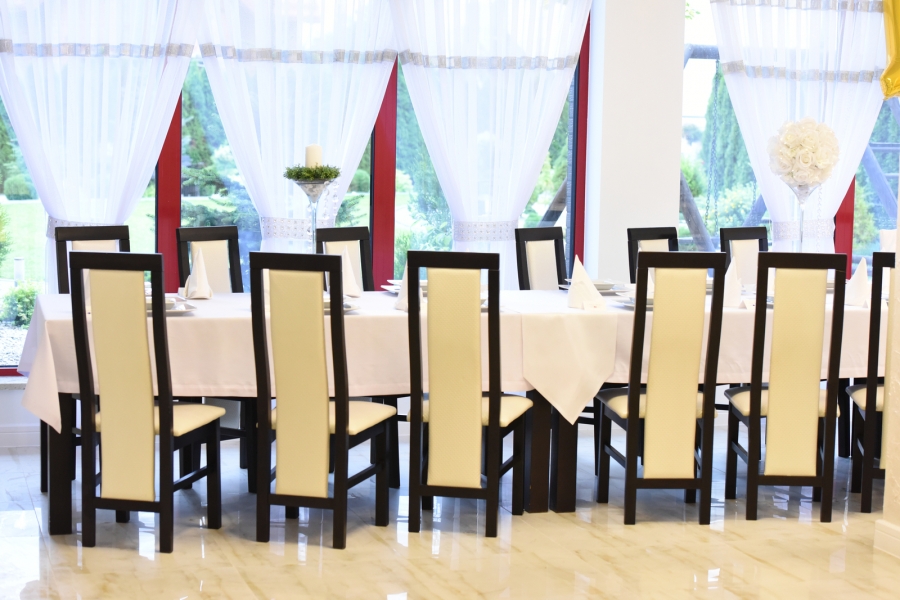
Identify the location of pointy folded napkins. This screenshot has width=900, height=600. (201, 277), (354, 280), (406, 296), (581, 291), (734, 288), (866, 284).